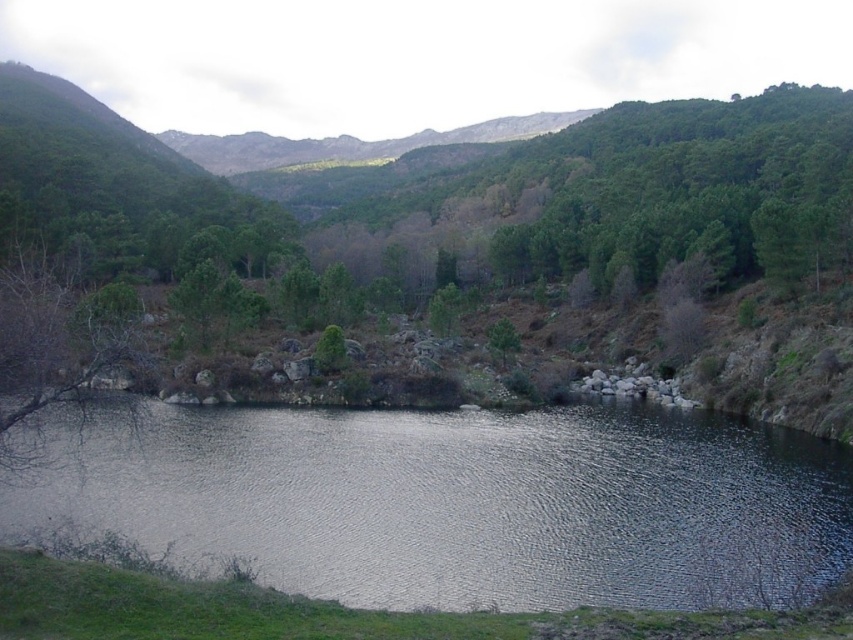
Question: Can you confirm if reflective water at center is wider than green matte tree at center?

Choices:
 (A) yes
 (B) no

Answer: (A)

Question: Which of the following is the closest to the observer?

Choices:
 (A) green matte tree at center
 (B) reflective water at center

Answer: (B)

Question: Which object appears closest to the camera in this image?

Choices:
 (A) green matte tree at center
 (B) reflective water at center

Answer: (B)

Question: Which of the following is the closest to the observer?

Choices:
 (A) green matte tree at center
 (B) reflective water at center

Answer: (B)

Question: Does reflective water at center have a greater width compared to green matte tree at center?

Choices:
 (A) no
 (B) yes

Answer: (B)

Question: Is reflective water at center above green matte tree at center?

Choices:
 (A) yes
 (B) no

Answer: (B)